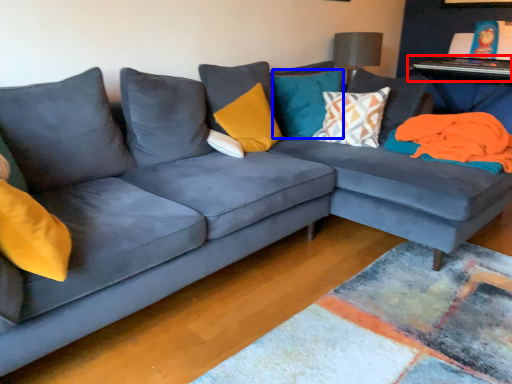
Question: Which point is further to the camera, table (highlighted by a red box) or pillow (highlighted by a blue box)?

Choices:
 (A) table
 (B) pillow

Answer: (A)